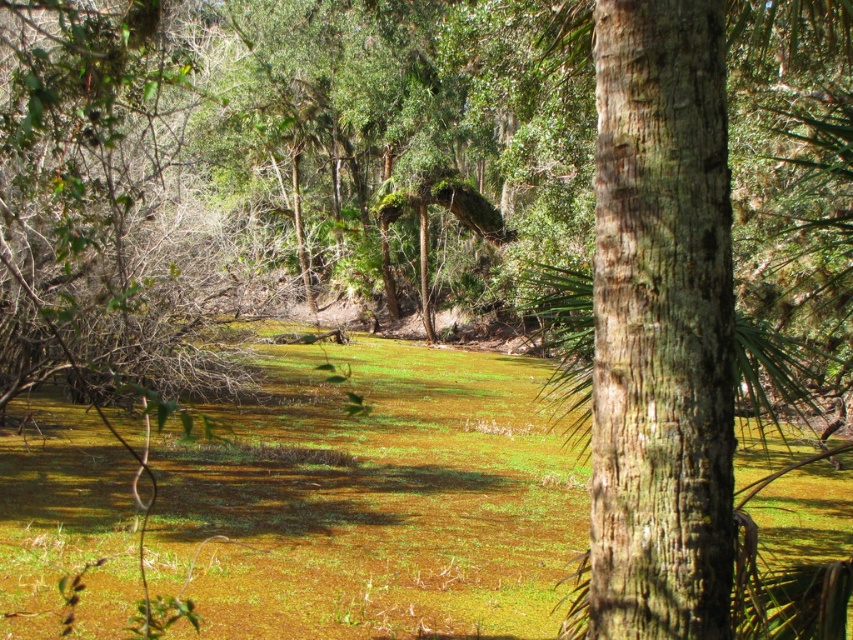
Question: Is the position of green mossy at center more distant than that of brown rough bark tree at center?

Choices:
 (A) no
 (B) yes

Answer: (B)

Question: Which point appears closest to the camera in this image?

Choices:
 (A) [x=35, y=524]
 (B) [x=601, y=164]

Answer: (B)

Question: Among these objects, which one is farthest from the camera?

Choices:
 (A) green mossy at center
 (B) brown rough bark tree at center

Answer: (A)

Question: Can you confirm if green mossy at center is wider than brown rough bark tree at center?

Choices:
 (A) yes
 (B) no

Answer: (A)

Question: Is green mossy at center bigger than brown rough bark tree at center?

Choices:
 (A) no
 (B) yes

Answer: (B)